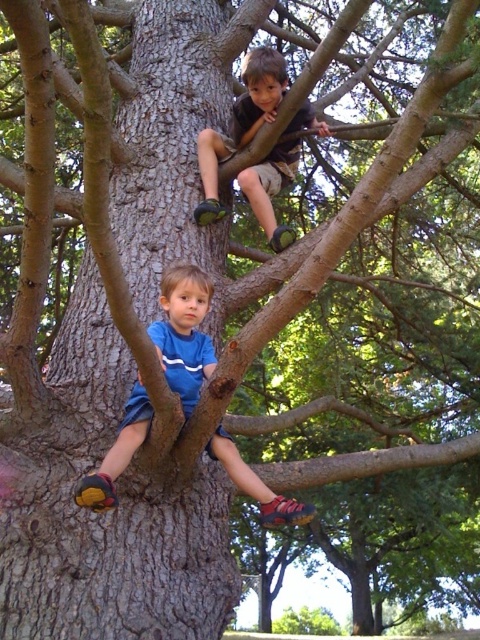
Question: In this image, where is blue fabric shorts at lower left located relative to matte brown shorts at upper center?

Choices:
 (A) right
 (B) left

Answer: (B)

Question: Which object is closer to the camera taking this photo?

Choices:
 (A) matte brown shorts at upper center
 (B) blue fabric shorts at lower left

Answer: (B)

Question: Is blue fabric shorts at lower left to the right of matte brown shorts at upper center from the viewer's perspective?

Choices:
 (A) yes
 (B) no

Answer: (B)

Question: Does blue fabric shorts at lower left appear under matte brown shorts at upper center?

Choices:
 (A) yes
 (B) no

Answer: (A)